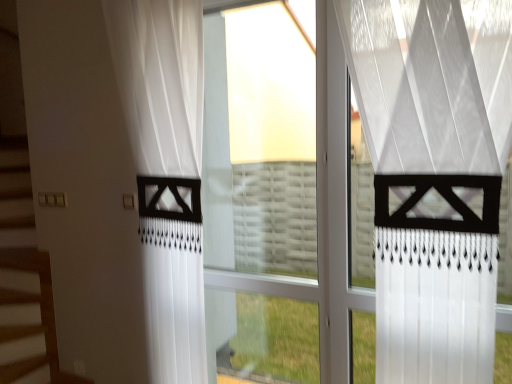
Question: Can you confirm if transparent glass window at center is positioned to the right of white sheer curtain at left, the 1th curtain viewed from the back?

Choices:
 (A) yes
 (B) no

Answer: (A)

Question: Is transparent glass window at center wider than white sheer curtain at left, placed as the 1th curtain when sorted from left to right?

Choices:
 (A) no
 (B) yes

Answer: (A)

Question: Is white sheer curtain at left, the 2th curtain viewed from the front, at the back of transparent glass window at center?

Choices:
 (A) no
 (B) yes

Answer: (A)

Question: Does transparent glass window at center have a lesser width compared to white sheer curtain at left, the 1th curtain viewed from the back?

Choices:
 (A) yes
 (B) no

Answer: (A)

Question: Does transparent glass window at center touch white sheer curtain at left, the 2th curtain viewed from the front?

Choices:
 (A) yes
 (B) no

Answer: (B)

Question: Is white sheer curtain at center, placed as the 2th curtain when sorted from left to right, wider or thinner than white sheer curtain at left, the 2th curtain viewed from the front?

Choices:
 (A) thin
 (B) wide

Answer: (A)

Question: Considering the positions of white sheer curtain at center, the 1th curtain positioned from the right, and white sheer curtain at left, the 1th curtain viewed from the back, in the image, is white sheer curtain at center, the 1th curtain positioned from the right, taller or shorter than white sheer curtain at left, the 1th curtain viewed from the back,?

Choices:
 (A) short
 (B) tall

Answer: (A)

Question: Would you say white sheer curtain at center, the 2th curtain positioned from the back, is to the left or to the right of white sheer curtain at left, the 2th curtain viewed from the front, in the picture?

Choices:
 (A) left
 (B) right

Answer: (B)

Question: Is white sheer curtain at center, the 2th curtain positioned from the back, inside the boundaries of white sheer curtain at left, placed as the 1th curtain when sorted from left to right, or outside?

Choices:
 (A) inside
 (B) outside

Answer: (B)

Question: From the image's perspective, is transparent glass window at center above or below white sheer curtain at center, which is the first curtain from front to back?

Choices:
 (A) below
 (B) above

Answer: (A)

Question: Based on their sizes in the image, would you say transparent glass window at center is bigger or smaller than white sheer curtain at center, placed as the 2th curtain when sorted from left to right?

Choices:
 (A) small
 (B) big

Answer: (A)

Question: Relative to white sheer curtain at center, placed as the 2th curtain when sorted from left to right, is transparent glass window at center in front or behind?

Choices:
 (A) front
 (B) behind

Answer: (B)

Question: From a real-world perspective, relative to white sheer curtain at center, the 1th curtain positioned from the right, is transparent glass window at center vertically above or below?

Choices:
 (A) below
 (B) above

Answer: (A)

Question: From a real-world perspective, relative to transparent glass window at center, is white sheer curtain at center, placed as the 2th curtain when sorted from left to right, vertically above or below?

Choices:
 (A) above
 (B) below

Answer: (A)

Question: Is point (451, 109) closer or farther from the camera than point (228, 274)?

Choices:
 (A) farther
 (B) closer

Answer: (B)